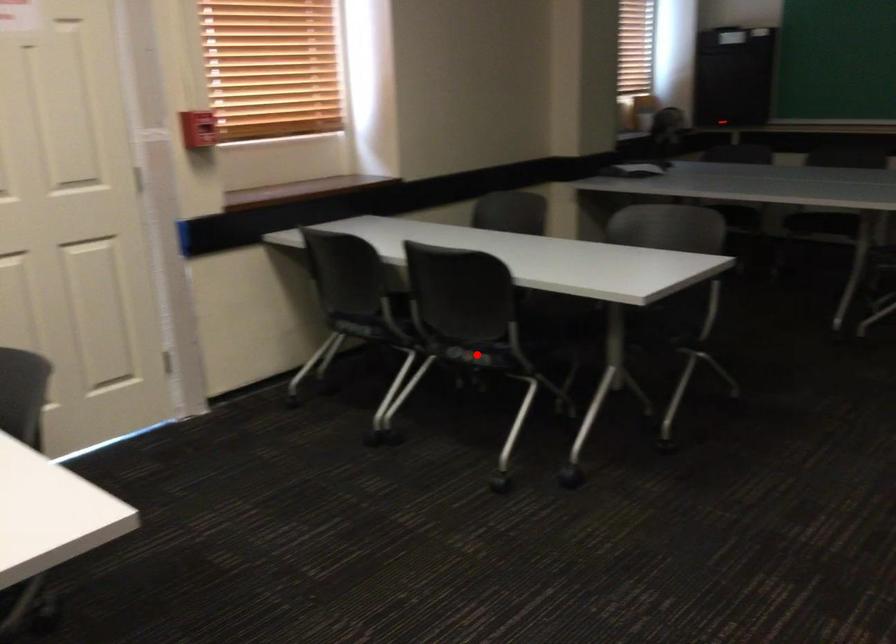
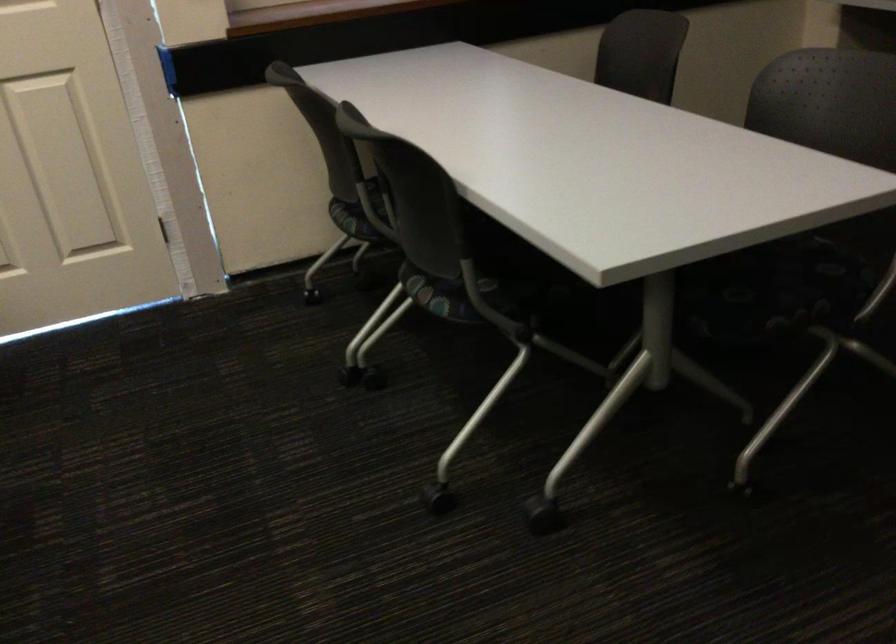
Locate, in the second image, the point that corresponds to the highlighted location in the first image.

(442, 295)